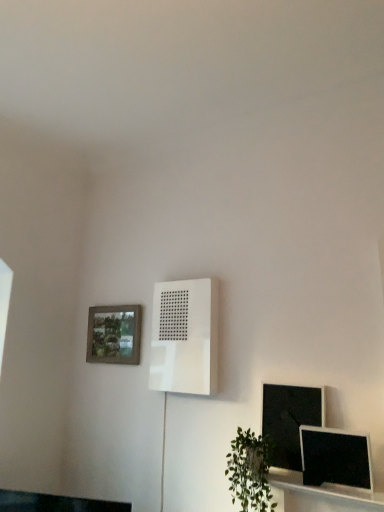
Question: Could you tell me if matte black monitor at lower right, marked as the second computer monitor in a back-to-front arrangement, is turned towards white matte air conditioner at center?

Choices:
 (A) no
 (B) yes

Answer: (A)

Question: Considering the relative sizes of matte black monitor at lower right, marked as the second computer monitor in a back-to-front arrangement, and white matte air conditioner at center in the image provided, is matte black monitor at lower right, marked as the second computer monitor in a back-to-front arrangement, smaller than white matte air conditioner at center?

Choices:
 (A) no
 (B) yes

Answer: (B)

Question: Considering the relative sizes of matte black monitor at lower right, marked as the first computer monitor in a front-to-back arrangement, and white matte air conditioner at center in the image provided, is matte black monitor at lower right, marked as the first computer monitor in a front-to-back arrangement, thinner than white matte air conditioner at center?

Choices:
 (A) no
 (B) yes

Answer: (B)

Question: Is the depth of matte black monitor at lower right, marked as the second computer monitor in a back-to-front arrangement, greater than that of white matte air conditioner at center?

Choices:
 (A) no
 (B) yes

Answer: (A)

Question: Is white matte air conditioner at center located within matte black monitor at lower right, marked as the second computer monitor in a back-to-front arrangement?

Choices:
 (A) no
 (B) yes

Answer: (A)

Question: Is white matte air conditioner at center in front of or behind wooden textured picture frame at upper left in the image?

Choices:
 (A) front
 (B) behind

Answer: (A)

Question: Considering the positions of point (190, 309) and point (135, 360), is point (190, 309) closer or farther from the camera than point (135, 360)?

Choices:
 (A) closer
 (B) farther

Answer: (A)

Question: In terms of height, does white matte air conditioner at center look taller or shorter compared to wooden textured picture frame at upper left?

Choices:
 (A) tall
 (B) short

Answer: (A)

Question: From a real-world perspective, is white matte air conditioner at center positioned above or below wooden textured picture frame at upper left?

Choices:
 (A) above
 (B) below

Answer: (A)

Question: Would you say matte black monitor at lower right, marked as the second computer monitor in a back-to-front arrangement, is inside or outside wooden textured picture frame at upper left?

Choices:
 (A) inside
 (B) outside

Answer: (B)

Question: Considering the positions of matte black monitor at lower right, marked as the first computer monitor in a front-to-back arrangement, and wooden textured picture frame at upper left in the image, is matte black monitor at lower right, marked as the first computer monitor in a front-to-back arrangement, taller or shorter than wooden textured picture frame at upper left?

Choices:
 (A) tall
 (B) short

Answer: (B)

Question: Considering the positions of matte black monitor at lower right, marked as the first computer monitor in a front-to-back arrangement, and wooden textured picture frame at upper left in the image, is matte black monitor at lower right, marked as the first computer monitor in a front-to-back arrangement, wider or thinner than wooden textured picture frame at upper left?

Choices:
 (A) thin
 (B) wide

Answer: (B)

Question: From the image's perspective, is matte black monitor at lower right, marked as the second computer monitor in a back-to-front arrangement, located above or below wooden textured picture frame at upper left?

Choices:
 (A) below
 (B) above

Answer: (A)

Question: From a real-world perspective, is white matte air conditioner at center above or below green leafy plant at lower right?

Choices:
 (A) above
 (B) below

Answer: (A)

Question: In terms of width, does white matte air conditioner at center look wider or thinner when compared to green leafy plant at lower right?

Choices:
 (A) wide
 (B) thin

Answer: (B)